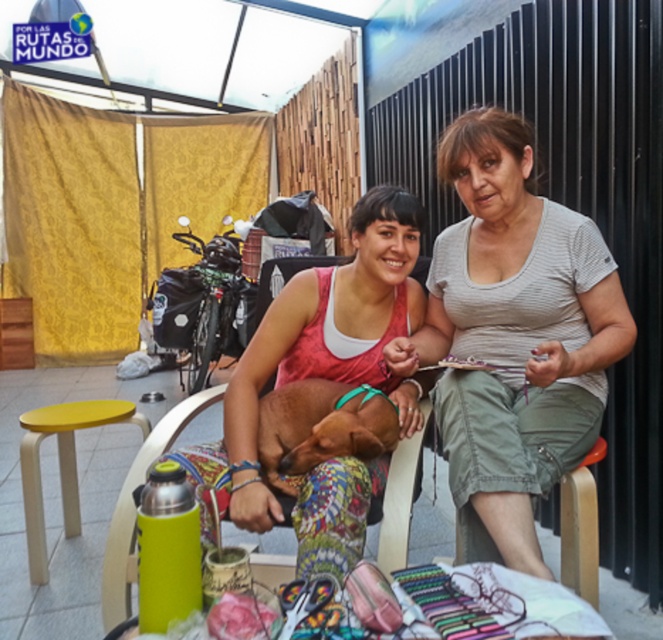
Who is more forward, (x=412, y=216) or (x=326, y=451)?

Positioned in front is point (x=326, y=451).

This screenshot has height=640, width=663. What do you see at coordinates (322, 394) in the screenshot?
I see `matte pink tank top at center` at bounding box center [322, 394].

The height and width of the screenshot is (640, 663). What are the coordinates of `matte pink tank top at center` in the screenshot? It's located at (322, 394).

Is gray striped shirt at center to the right of brown leather dog at center from the viewer's perspective?

Correct, you'll find gray striped shirt at center to the right of brown leather dog at center.

Which of these two, gray striped shirt at center or brown leather dog at center, stands shorter?

brown leather dog at center is shorter.

Between point (530, 465) and point (337, 449), which one is positioned in front?

Point (530, 465) is more forward.

I want to click on gray striped shirt at center, so click(512, 337).

Can you confirm if gray striped shirt at center is smaller than yellow matte stool at lower left?

Actually, gray striped shirt at center might be larger than yellow matte stool at lower left.

Which is in front, point (538, 205) or point (42, 417)?

Point (538, 205) is more forward.

Who is more distant from viewer, (453, 148) or (34, 474)?

Positioned behind is point (34, 474).

At what (x,y) coordinates should I click in order to perform the action: click on gray striped shirt at center. Please return your answer as a coordinate pair (x, y). This screenshot has height=640, width=663. Looking at the image, I should click on pyautogui.click(x=512, y=337).